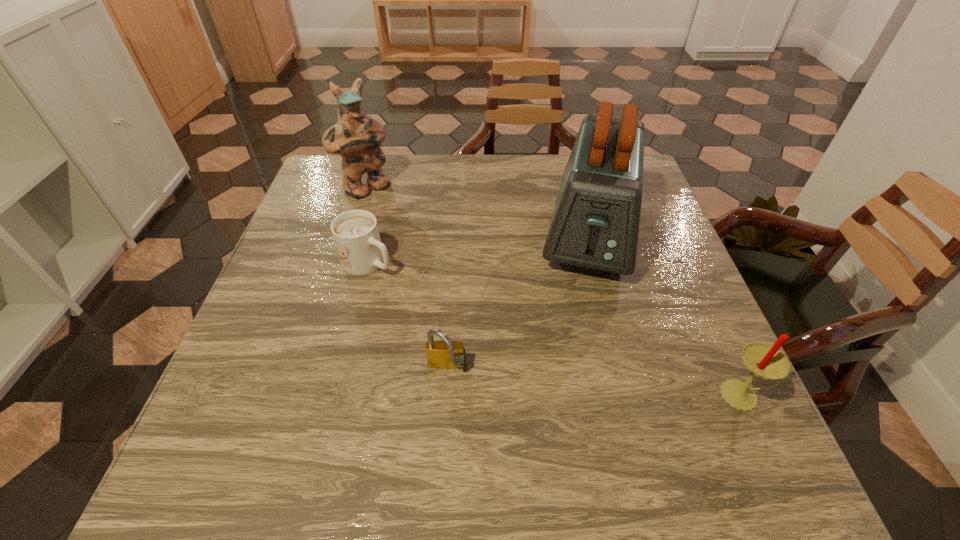
Locate an element on the screen. The width and height of the screenshot is (960, 540). free spot between the candle and the cappuccino is located at coordinates (556, 329).

Identify which object is the third nearest to the padlock. Please provide its 2D coordinates. Your answer should be formatted as a tuple, i.e. [(x, y)], where the tuple contains the x and y coordinates of a point satisfying the conditions above.

[(763, 360)]

Find the location of a particular element. Image resolution: width=960 pixels, height=540 pixels. object that stands as the closest to the padlock is located at coordinates (355, 232).